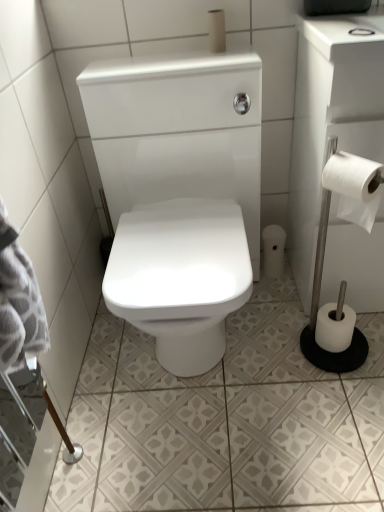
Where is `free space in front of white matte toilet paper at lower right, acting as the fourth toilet paper starting from the top`? free space in front of white matte toilet paper at lower right, acting as the fourth toilet paper starting from the top is located at coordinates (340, 387).